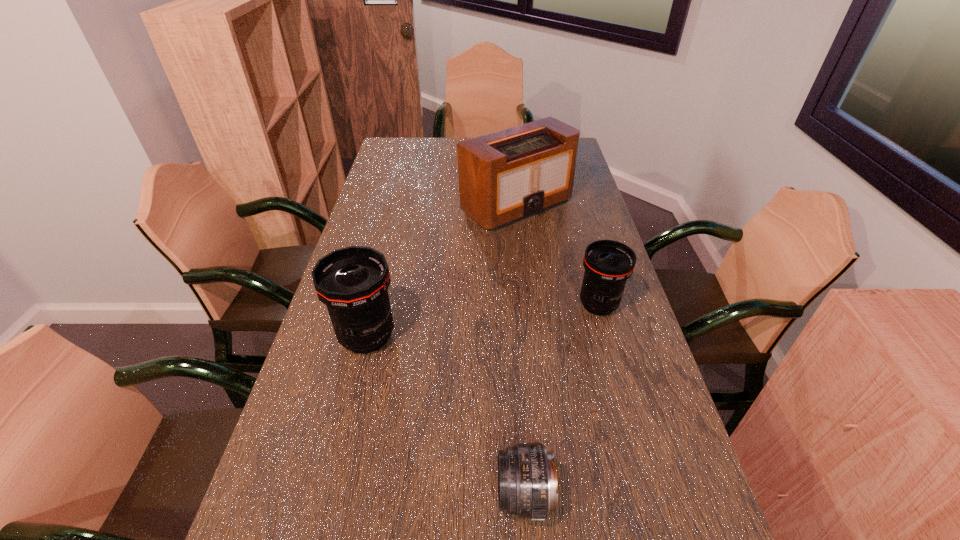
This screenshot has height=540, width=960. I want to click on radio receiver, so click(506, 176).

I want to click on the leftmost telephoto lens, so [352, 282].

Image resolution: width=960 pixels, height=540 pixels. Identify the location of the tallest telephoto lens. 352,282.

I want to click on the second tallest telephoto lens, so click(x=608, y=264).

You are a GUI agent. You are given a task and a screenshot of the screen. Output one action in this format:
    pyautogui.click(x=<x>, y=<y>)
    Task: Click on the second shortest object
    
    Given the screenshot: What is the action you would take?
    pyautogui.click(x=608, y=264)

This screenshot has height=540, width=960. What are the coordinates of `the nearest object` in the screenshot? It's located at (527, 480).

Image resolution: width=960 pixels, height=540 pixels. I want to click on the shortest object, so click(x=527, y=480).

Where is `vacant area located 0.330m on the left of the farthest object`? This screenshot has height=540, width=960. vacant area located 0.330m on the left of the farthest object is located at coordinates 368,205.

Identify the location of blank area located on the right of the tallest telephoto lens. The height and width of the screenshot is (540, 960). (548, 336).

Where is `blank space located 0.130m on the back of the rightmost telephoto lens`? The image size is (960, 540). blank space located 0.130m on the back of the rightmost telephoto lens is located at coordinates (586, 260).